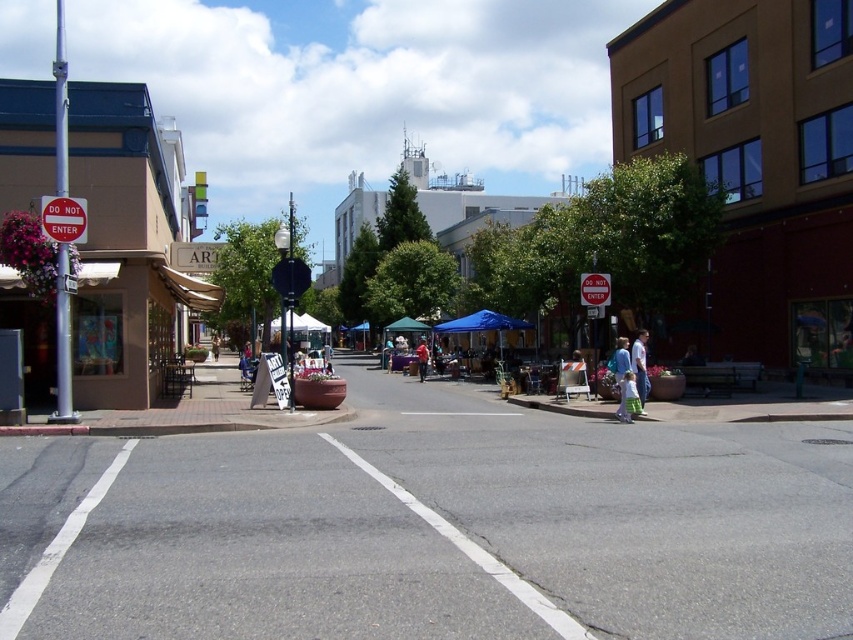
Can you confirm if smooth asphalt road at center is positioned above smooth concrete sidewalk at center?

Incorrect, smooth asphalt road at center is not positioned above smooth concrete sidewalk at center.

Does smooth asphalt road at center appear under smooth concrete sidewalk at center?

Yes.

This screenshot has height=640, width=853. What are the coordinates of `smooth asphalt road at center` in the screenshot? It's located at (432, 529).

Does point (624, 340) lie behind point (421, 364)?

No, (624, 340) is closer to viewer.

What do you see at coordinates (619, 371) in the screenshot?
I see `light blue denim jeans at center` at bounding box center [619, 371].

This screenshot has height=640, width=853. In order to click on light blue denim jeans at center in this screenshot , I will do `click(619, 371)`.

Can you confirm if smooth asphalt road at center is smaller than red plastic sign at center?

Actually, smooth asphalt road at center might be larger than red plastic sign at center.

Between smooth asphalt road at center and red plastic sign at center, which one appears on the right side from the viewer's perspective?

smooth asphalt road at center

The image size is (853, 640). Find the location of `smooth asphalt road at center`. smooth asphalt road at center is located at coordinates (432, 529).